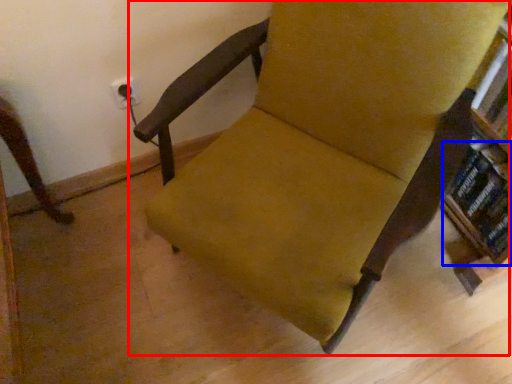
Question: Which point is further to the camera, chair (highlighted by a red box) or book (highlighted by a blue box)?

Choices:
 (A) chair
 (B) book

Answer: (B)